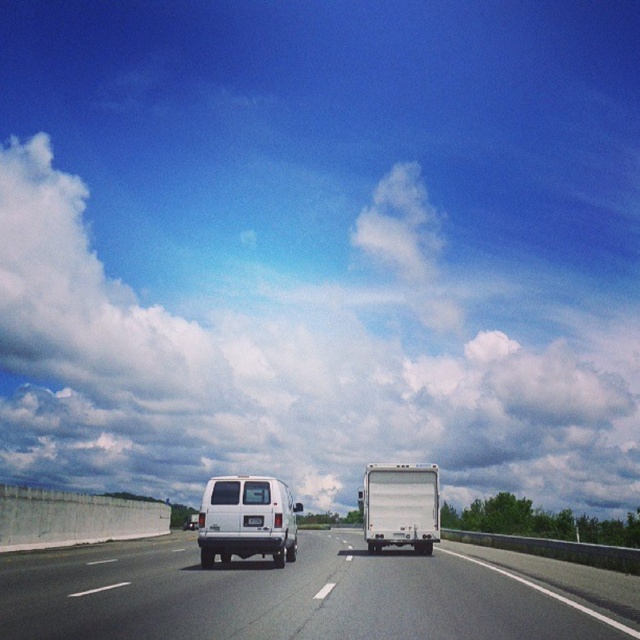
Question: Based on their relative distances, which object is nearer to the white matte van at center?

Choices:
 (A) white fluffy cloud at upper center
 (B) white glossy van at center

Answer: (B)

Question: Does white fluffy cloud at upper center have a larger size compared to white matte van at center?

Choices:
 (A) yes
 (B) no

Answer: (A)

Question: Is white fluffy cloud at upper center to the right of white matte van at center from the viewer's perspective?

Choices:
 (A) no
 (B) yes

Answer: (A)

Question: Estimate the real-world distances between objects in this image. Which object is closer to the white matte truck at center?

Choices:
 (A) white glossy van at center
 (B) white fluffy cloud at upper center
 (C) white matte license plate at rear
 (D) white matte van at center

Answer: (A)

Question: Is white matte van at center thinner than white matte truck at center?

Choices:
 (A) no
 (B) yes

Answer: (B)

Question: Which of the following is the closest to the observer?

Choices:
 (A) white matte truck at center
 (B) white matte license plate at rear
 (C) white matte van at center
 (D) white fluffy cloud at upper center

Answer: (B)